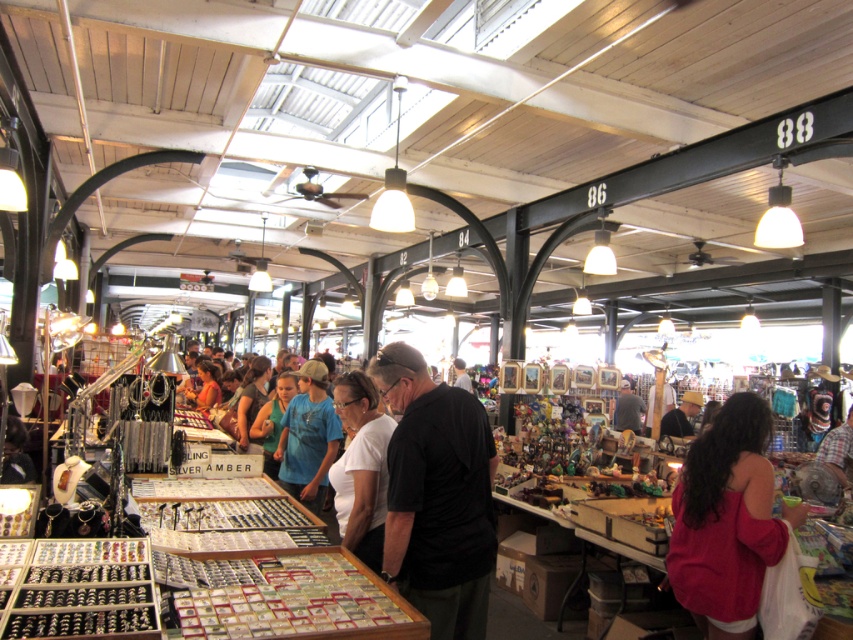
Question: Does red matte sweater at lower right appear over white matte shirt at center?

Choices:
 (A) yes
 (B) no

Answer: (B)

Question: Which object is farther from the camera taking this photo?

Choices:
 (A) blue t-shirt at center
 (B) red matte sweater at lower right
 (C) white matte shirt at center

Answer: (A)

Question: Which object appears closest to the camera in this image?

Choices:
 (A) black matte shirt at center
 (B) red matte sweater at lower right
 (C) white matte shirt at center
 (D) blue t-shirt at center

Answer: (A)

Question: Is black matte shirt at center below gray fabric shirt at center?

Choices:
 (A) no
 (B) yes

Answer: (A)

Question: Is red matte sweater at lower right above white matte shirt at center?

Choices:
 (A) yes
 (B) no

Answer: (B)

Question: Which of these objects is positioned closest to the gray fabric shirt at center?

Choices:
 (A) black matte shirt at center
 (B) white matte shirt at center
 (C) blue t-shirt at center
 (D) red matte sweater at lower right

Answer: (C)